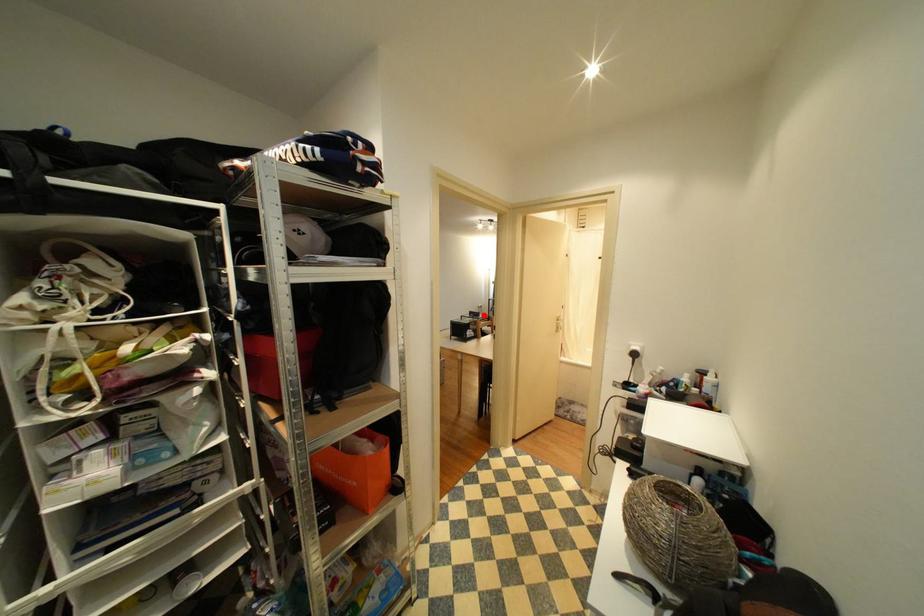
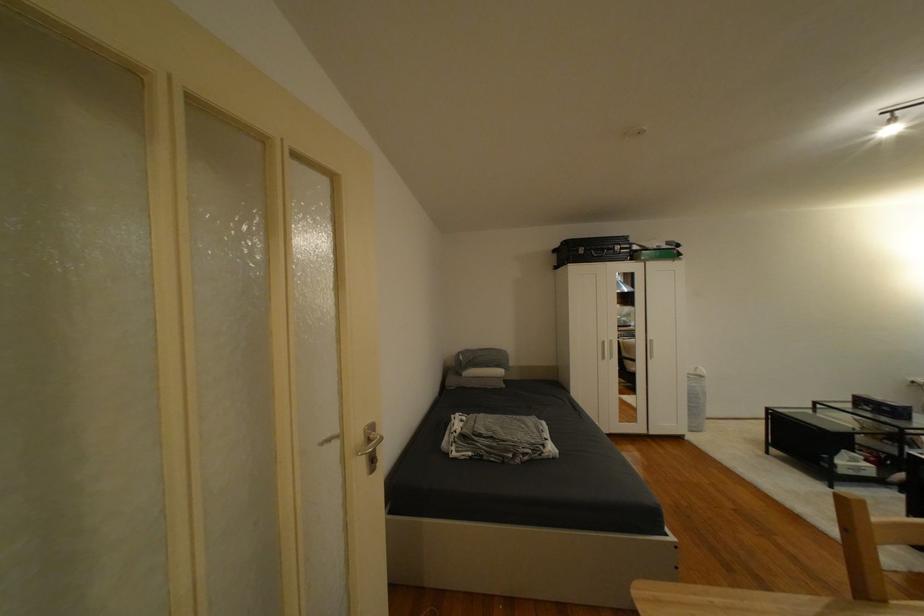
Question: I am providing you with two images of the same scene from different viewpoints. A red point is shown in image1. For the corresponding object point in image2, is it positioned nearer or farther from the camera?

Choices:
 (A) Nearer
 (B) Farther

Answer: (A)